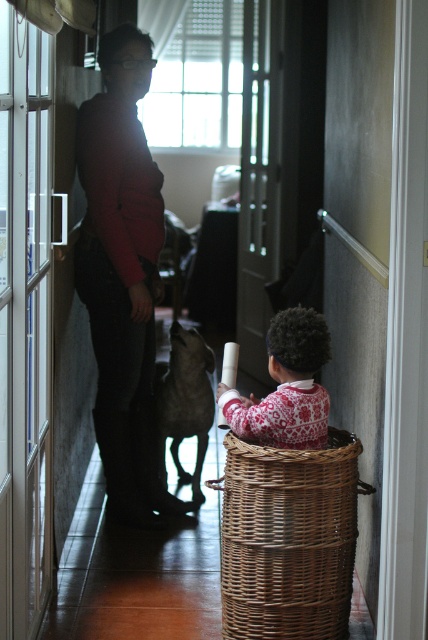
Question: Which of the following is the farthest from the observer?

Choices:
 (A) woven brown basket at lower right
 (B) red and white sweater at center

Answer: (B)

Question: Which object appears farthest from the camera in this image?

Choices:
 (A) red and white sweater at center
 (B) woven brown basket at lower right
 (C) matte red sweater at center

Answer: (C)

Question: Can you confirm if woven brown basket at lower right is wider than red and white sweater at center?

Choices:
 (A) no
 (B) yes

Answer: (B)

Question: Which of the following is the farthest from the observer?

Choices:
 (A) red and white sweater at center
 (B) matte red sweater at center

Answer: (B)

Question: Where is matte red sweater at center located in relation to red and white sweater at center in the image?

Choices:
 (A) above
 (B) below

Answer: (A)

Question: Can you confirm if matte red sweater at center is thinner than woven brown basket at lower right?

Choices:
 (A) yes
 (B) no

Answer: (A)